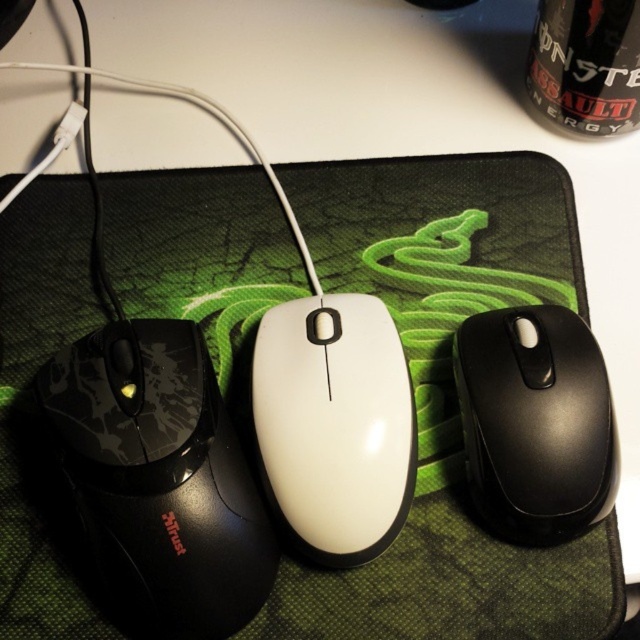
Consider the image. You are trying to locate the green fabric mousepad at center in the image. What are the coordinates of its position?

The green fabric mousepad at center is located at coordinates point [445,396].

You are setting up a workstation and want to place the black matte mouse at left and the white glossy mouse at center on the mousepad. If the mousepad has limited space, which mouse would you prioritize placing first to ensure it fits?

The black matte mouse at left is larger than the white glossy mouse at center, so you should prioritize placing the black matte mouse at left first to ensure it fits on the mousepad.